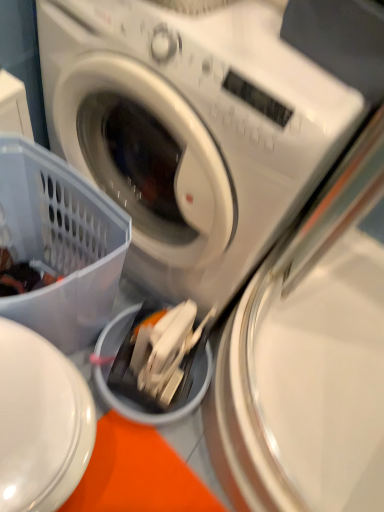
Question: Does metallic silver washing machine at center, positioned as the 2th washing machine in top-to-bottom order, appear on the left side of white plastic washing machine at center, positioned as the 2th washing machine in bottom-to-top order?

Choices:
 (A) no
 (B) yes

Answer: (A)

Question: Considering the relative positions of metallic silver washing machine at center, which appears as the 1th washing machine when ordered from the bottom, and white plastic washing machine at center, the first washing machine when ordered from top to bottom, in the image provided, is metallic silver washing machine at center, which appears as the 1th washing machine when ordered from the bottom, in front of white plastic washing machine at center, the first washing machine when ordered from top to bottom,?

Choices:
 (A) no
 (B) yes

Answer: (A)

Question: Are metallic silver washing machine at center, positioned as the 2th washing machine in top-to-bottom order, and white plastic washing machine at center, the first washing machine when ordered from top to bottom, far apart?

Choices:
 (A) yes
 (B) no

Answer: (B)

Question: From the image's perspective, is metallic silver washing machine at center, which appears as the 1th washing machine when ordered from the bottom, on white plastic washing machine at center, the first washing machine when ordered from top to bottom?

Choices:
 (A) yes
 (B) no

Answer: (B)

Question: Is metallic silver washing machine at center, positioned as the 2th washing machine in top-to-bottom order, facing away from white plastic washing machine at center, positioned as the 2th washing machine in bottom-to-top order?

Choices:
 (A) yes
 (B) no

Answer: (B)

Question: Is the position of metallic silver washing machine at center, which appears as the 1th washing machine when ordered from the bottom, more distant than that of white plastic washing machine at center, positioned as the 2th washing machine in bottom-to-top order?

Choices:
 (A) yes
 (B) no

Answer: (A)

Question: Can you confirm if translucent plastic basket at lower left is taller than metallic silver washing machine at center, positioned as the 2th washing machine in top-to-bottom order?

Choices:
 (A) yes
 (B) no

Answer: (A)

Question: Is translucent plastic basket at lower left positioned in front of metallic silver washing machine at center, which appears as the 1th washing machine when ordered from the bottom?

Choices:
 (A) no
 (B) yes

Answer: (B)

Question: From the image's perspective, is translucent plastic basket at lower left above metallic silver washing machine at center, positioned as the 2th washing machine in top-to-bottom order?

Choices:
 (A) yes
 (B) no

Answer: (A)

Question: Is translucent plastic basket at lower left wider than metallic silver washing machine at center, which appears as the 1th washing machine when ordered from the bottom?

Choices:
 (A) yes
 (B) no

Answer: (B)

Question: Can you confirm if translucent plastic basket at lower left is shorter than metallic silver washing machine at center, which appears as the 1th washing machine when ordered from the bottom?

Choices:
 (A) yes
 (B) no

Answer: (B)

Question: Considering the relative positions of translucent plastic basket at lower left and metallic silver washing machine at center, positioned as the 2th washing machine in top-to-bottom order, in the image provided, is translucent plastic basket at lower left behind metallic silver washing machine at center, positioned as the 2th washing machine in top-to-bottom order,?

Choices:
 (A) no
 (B) yes

Answer: (A)

Question: Does white plastic washing machine at center, the first washing machine when ordered from top to bottom, appear on the left side of metallic silver washing machine at center, which appears as the 1th washing machine when ordered from the bottom?

Choices:
 (A) no
 (B) yes

Answer: (B)